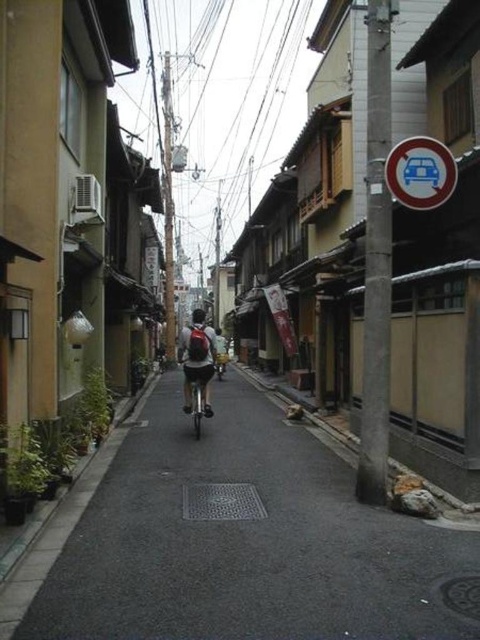
Does point (72, 582) lie in front of point (201, 362)?

Yes, it is.

Can you confirm if dark gray asphalt at center is taller than matte black backpack at center?

No, dark gray asphalt at center is not taller than matte black backpack at center.

What do you see at coordinates (248, 541) in the screenshot? This screenshot has width=480, height=640. I see `dark gray asphalt at center` at bounding box center [248, 541].

At what (x,y) coordinates should I click in order to perform the action: click on dark gray asphalt at center. Please return your answer as a coordinate pair (x, y). Looking at the image, I should click on (248, 541).

Is the position of metallic reflective no parking sign at upper right less distant than that of shiny metallic bicycle at center?

Yes, metallic reflective no parking sign at upper right is closer to the viewer.

Measure the distance between point (444, 180) and camera.

The distance of point (444, 180) from camera is 7.05 meters.

Who is more distant from viewer, (431, 152) or (222, 372)?

The point (222, 372) is behind.

At what (x,y) coordinates should I click in order to perform the action: click on metallic reflective no parking sign at upper right. Please return your answer as a coordinate pair (x, y). This screenshot has width=480, height=640. Looking at the image, I should click on (420, 172).

Is dark gray asphalt at center wider than metallic reflective no parking sign at upper right?

Correct, the width of dark gray asphalt at center exceeds that of metallic reflective no parking sign at upper right.

Does point (287, 419) come farther from viewer compared to point (410, 182)?

Yes, it is.

This screenshot has height=640, width=480. What do you see at coordinates (248, 541) in the screenshot?
I see `dark gray asphalt at center` at bounding box center [248, 541].

Identify the location of dark gray asphalt at center. The width and height of the screenshot is (480, 640). (248, 541).